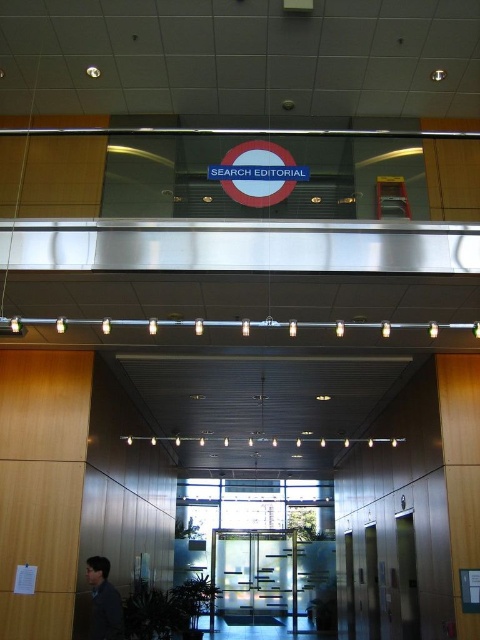
Who is positioned more to the right, transparent glass doors at center or dark gray jacket at lower left?

From the viewer's perspective, transparent glass doors at center appears more on the right side.

Find the location of a particular element. The width and height of the screenshot is (480, 640). transparent glass doors at center is located at coordinates (254, 573).